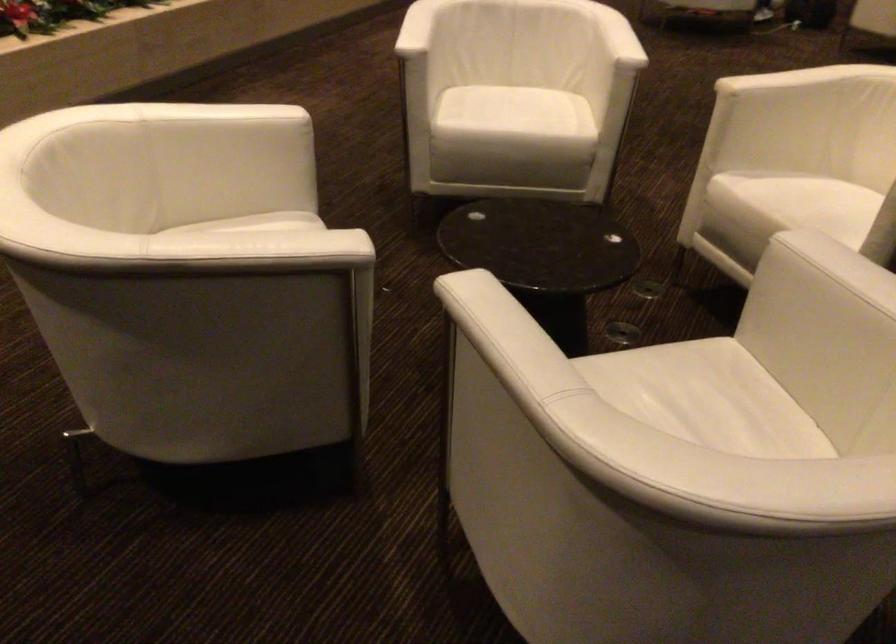
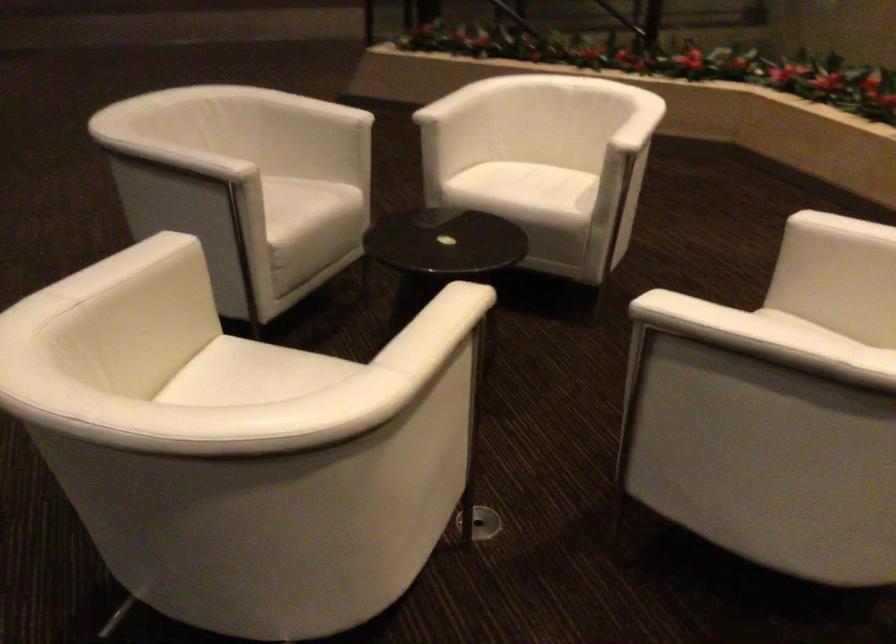
Find the pixel in the second image that matches pixel 771 75 in the first image.

(437, 308)